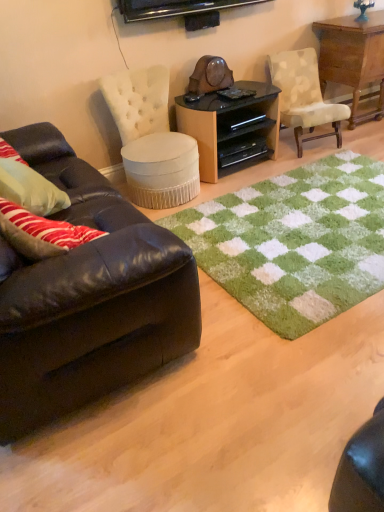
Where is `free spot below green shaggy rug at center (from a real-world perspective)`? This screenshot has width=384, height=512. free spot below green shaggy rug at center (from a real-world perspective) is located at coordinates (316, 228).